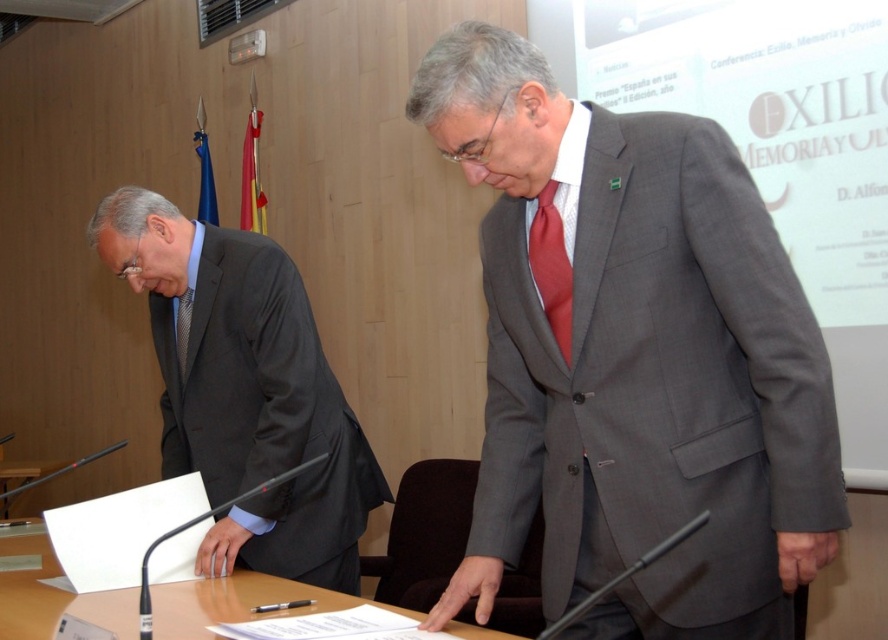
You are organizing a meeting and need to place a laptop on the largest available surface in the scene. Which object should you choose between the clear glass table at center and the white paper at lower left?

The clear glass table at center is bigger than the white paper at lower left, so you should place the laptop on the clear glass table at center.

Looking at this image, you are an event organizer preparing for a presentation. You need to ensure that the speaker can easily access their notes on the white paper at lower left without obstructing the audience view of the matte red tie at center. Is this arrangement possible?

The matte red tie at center is behind the white paper at lower left, so the speaker can access the white paper at lower left without blocking the audience view of the matte red tie at center as the paper is in front.